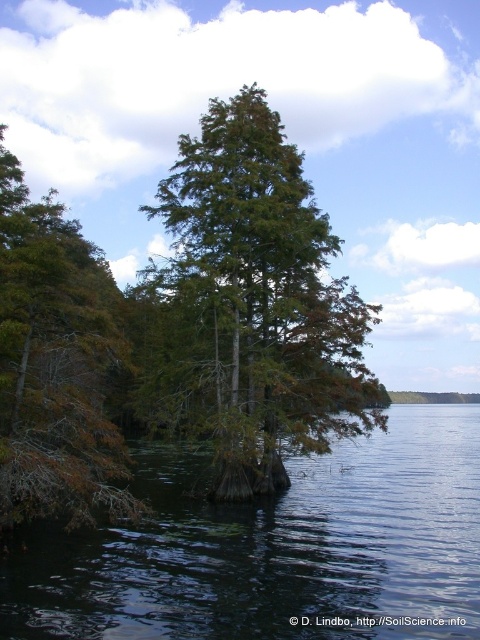
Who is more forward, (207, 202) or (27, 480)?

Positioned in front is point (27, 480).

Does green matte tree at center appear under brown matte tree at left?

Yes, green matte tree at center is below brown matte tree at left.

Is point (260, 378) closer to camera compared to point (72, 406)?

No.

The image size is (480, 640). Find the location of `green matte tree at center`. green matte tree at center is located at coordinates tap(257, 300).

Identify the location of dark green water at lower left. The image size is (480, 640). (277, 548).

Who is more distant from viewer, [456,624] or [11,340]?

Positioned behind is point [11,340].

Find the location of `dark green water at lower left`. dark green water at lower left is located at coordinates (277, 548).

What are the coordinates of `dark green water at lower left` in the screenshot? It's located at (277, 548).

Is point (115, 589) positioned before point (322, 333)?

Yes, it is.

Is dark green water at lower left wider than green matte tree at center?

Yes, dark green water at lower left is wider than green matte tree at center.

Is point (339, 621) farther from camera compared to point (232, 192)?

That is False.

Locate an element on the screen. dark green water at lower left is located at coordinates (277, 548).